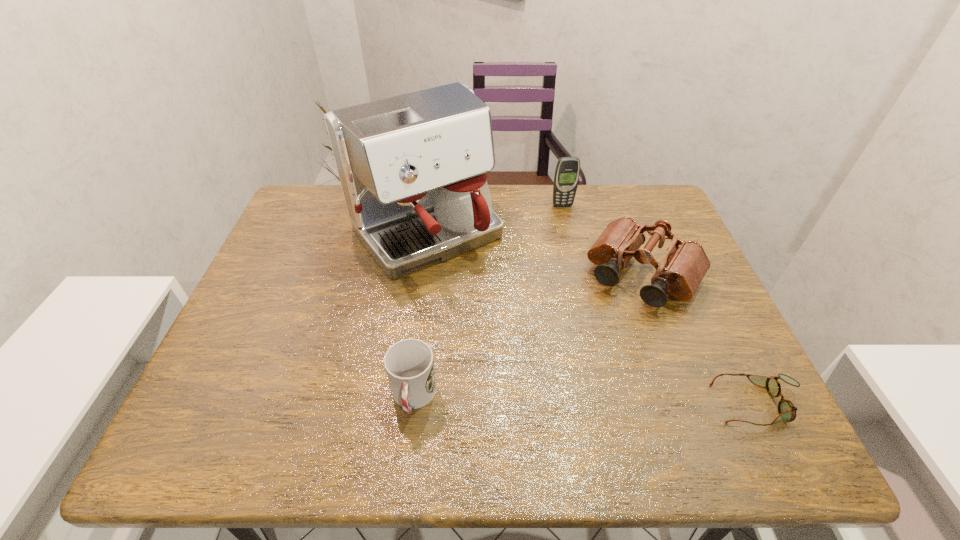
Locate an element on the screen. blank area in the image that satisfies the following two spatial constraints: 1. on the front side of the spectacles; 2. on the front-facing side of the tallest object is located at coordinates (403, 404).